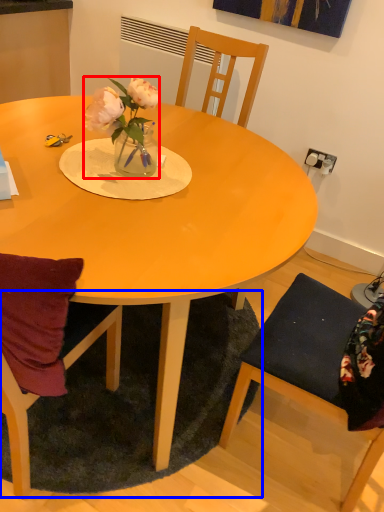
Question: Which object is closer to the camera taking this photo, houseplant (highlighted by a red box) or mat (highlighted by a blue box)?

Choices:
 (A) houseplant
 (B) mat

Answer: (A)